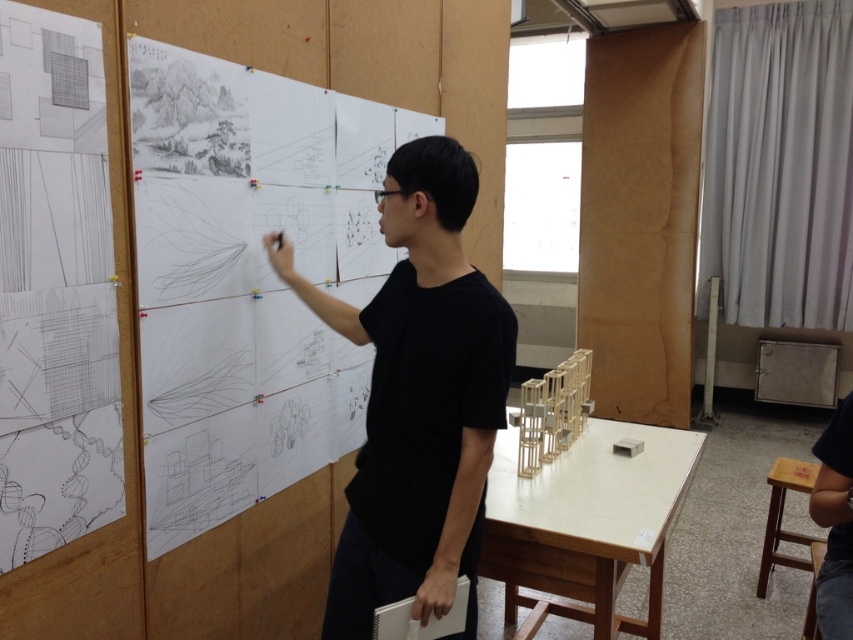
From the picture: You are standing in the art studio and want to reach the point marked as point [456,365] on the corkboard wall. If you take a step forward of 1 meter, will you be able to touch the point with your outstretched hand?

The point [456,365] is 1.40 meters away from the viewer. After stepping forward 1 meter, the distance becomes 0.40 meters. Since an average person can reach about 0.5 meters with an outstretched hand, you can touch the point.

Based on the photo, you are an art student who needs to sit down to sketch. You see the black matte shirt at center and the wooden stool at lower right. Which object is closer to you as you look at the scene?

The black matte shirt at center is closer to you because it is in front of the wooden stool at lower right.

You are an observer in the art studio. You notice the black matte shirt at center and the white matte table at center. Which object takes up more space in the image?

The black matte shirt at center takes up more space in the image because it is bigger than the white matte table at center.